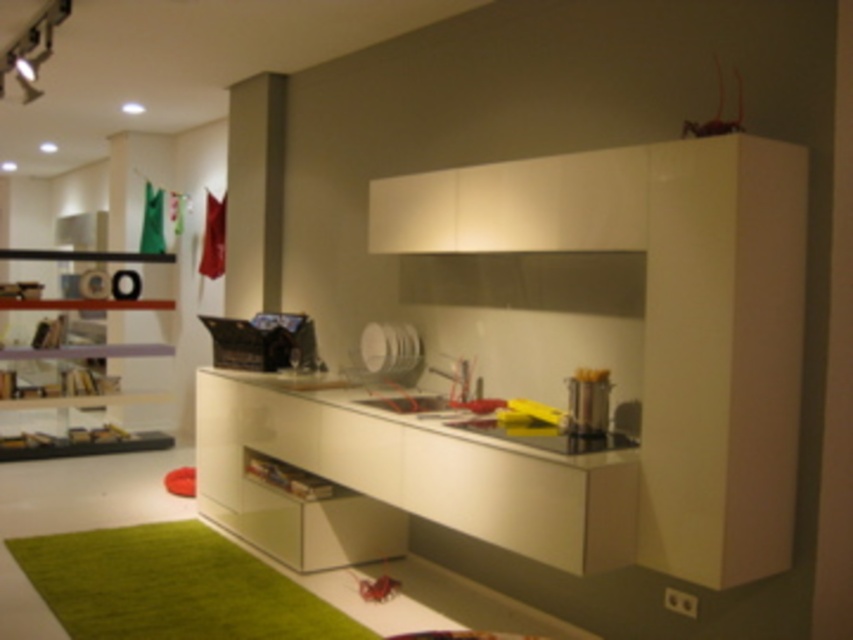
Question: Is white glossy drawer at lower center smaller than satin silver pot at center?

Choices:
 (A) no
 (B) yes

Answer: (A)

Question: Considering the real-world distances, which object is farthest from the satin silver pot at center?

Choices:
 (A) white glossy counter top at center
 (B) white glossy drawer at lower center

Answer: (B)

Question: Which point appears farthest from the camera in this image?

Choices:
 (A) (318, 444)
 (B) (577, 376)
 (C) (219, 477)

Answer: (C)

Question: Is white glossy counter top at center above satin silver pot at center?

Choices:
 (A) yes
 (B) no

Answer: (B)

Question: Is white glossy counter top at center to the right of satin silver pot at center from the viewer's perspective?

Choices:
 (A) no
 (B) yes

Answer: (A)

Question: Estimate the real-world distances between objects in this image. Which object is farther from the white glossy drawer at lower center?

Choices:
 (A) satin silver pot at center
 (B) white glossy counter top at center

Answer: (A)